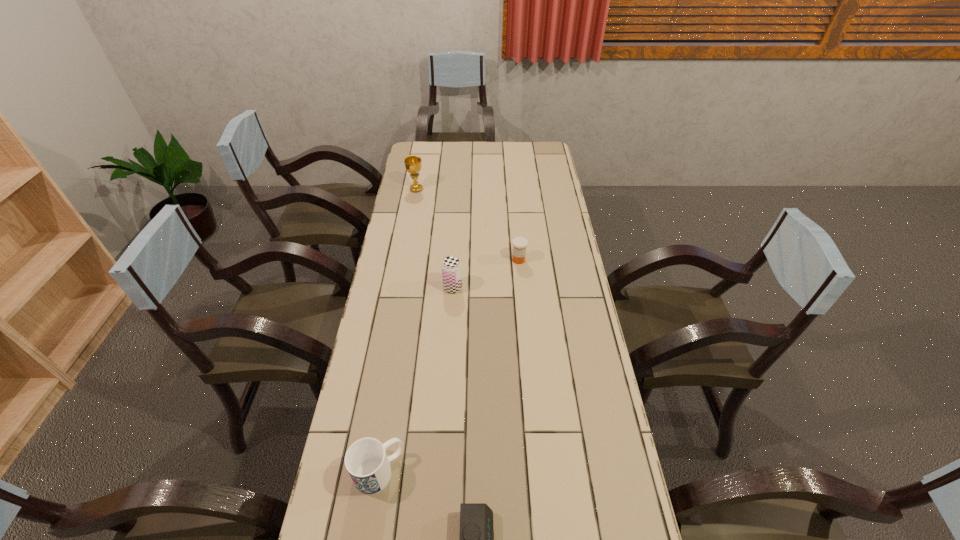
This screenshot has height=540, width=960. I want to click on free region located on the left of the third shortest object, so click(x=335, y=472).

Locate an element on the screen. This screenshot has height=540, width=960. blank space located on the label of the fourth tallest object is located at coordinates (520, 280).

The image size is (960, 540). I want to click on chalice situated at the left edge, so click(413, 165).

Find the location of `mug that is at the left edge`. mug that is at the left edge is located at coordinates [366, 461].

Locate an element on the screen. vacant region at the far edge of the desktop is located at coordinates click(x=444, y=157).

I want to click on vacant space at the left edge, so click(x=419, y=295).

In the image, there is a desktop. What are the coordinates of `free space at the right edge` in the screenshot? It's located at (563, 233).

This screenshot has height=540, width=960. Identify the location of blank space at the far right corner of the desktop. (540, 150).

Find the location of a particular element. The width and height of the screenshot is (960, 540). empty location between the third object from left to right and the farthest object is located at coordinates (435, 239).

Where is `free space between the fourth farthest object and the farthest object`? free space between the fourth farthest object and the farthest object is located at coordinates (397, 330).